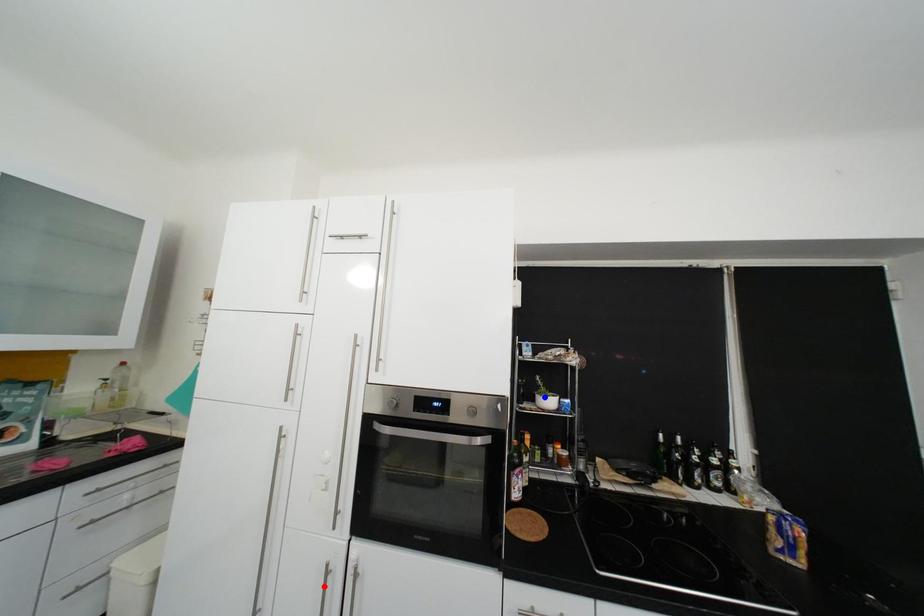
Question: Two points are marked on the image. Which point is closer to the camera?

Choices:
 (A) Blue point is closer.
 (B) Red point is closer.

Answer: (B)